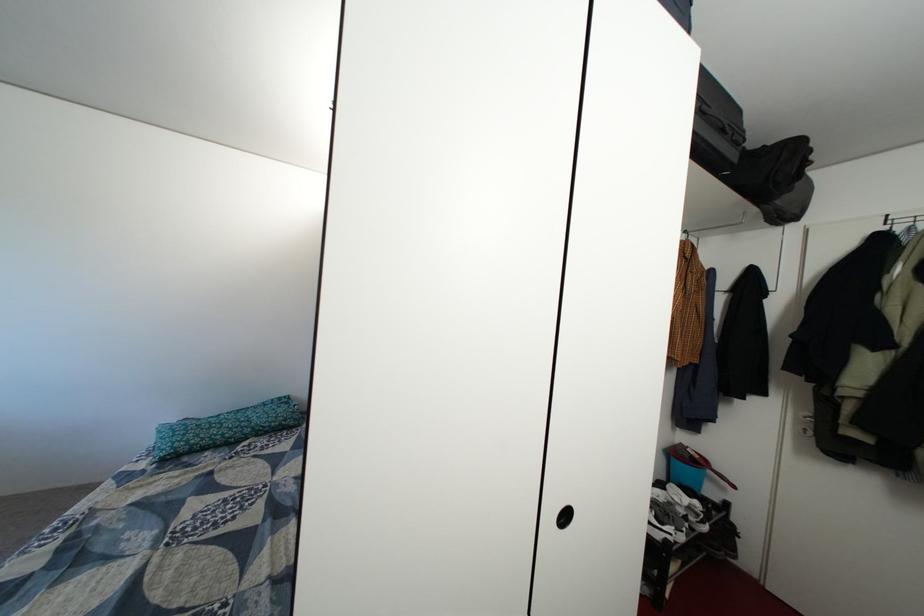
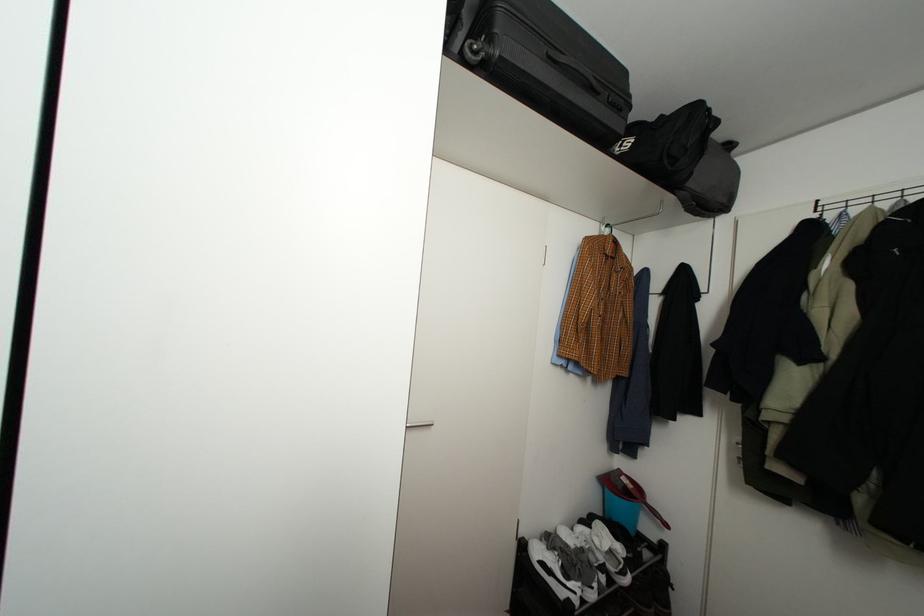
Question: Based on the continuous images, in which direction is the camera rotating? Reply with the corresponding letter.

Choices:
 (A) Left
 (B) Right
 (C) Up
 (D) Down

Answer: (C)